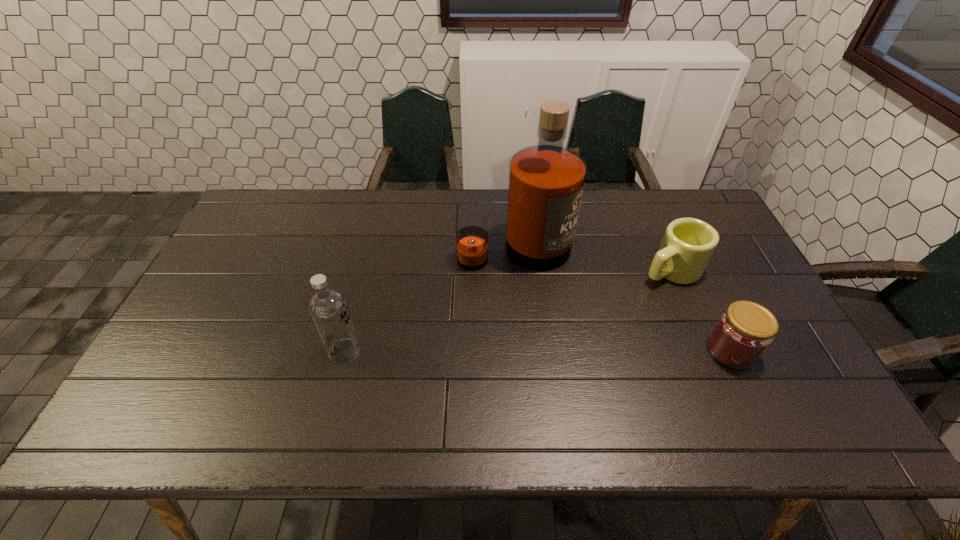
The width and height of the screenshot is (960, 540). I want to click on vodka, so click(x=328, y=308).

Identify the location of the third shortest object. (328, 308).

The width and height of the screenshot is (960, 540). I want to click on jam, so click(x=744, y=331).

Locate an element on the screen. The width and height of the screenshot is (960, 540). liquor is located at coordinates (546, 181).

Locate an element on the screen. This screenshot has width=960, height=540. the third object from right to left is located at coordinates (546, 181).

This screenshot has width=960, height=540. What are the coordinates of `mug` in the screenshot? It's located at (688, 244).

Locate an element on the screen. The height and width of the screenshot is (540, 960). free space located 0.350m on the front label of the leftmost object is located at coordinates (499, 352).

Where is `blank area located on the left of the jam`? The width and height of the screenshot is (960, 540). blank area located on the left of the jam is located at coordinates (663, 350).

This screenshot has height=540, width=960. Identify the location of free space located 0.190m on the front label of the tallest object. (568, 316).

Where is `vacant region located on the front label of the tallest object`? This screenshot has width=960, height=540. vacant region located on the front label of the tallest object is located at coordinates [593, 354].